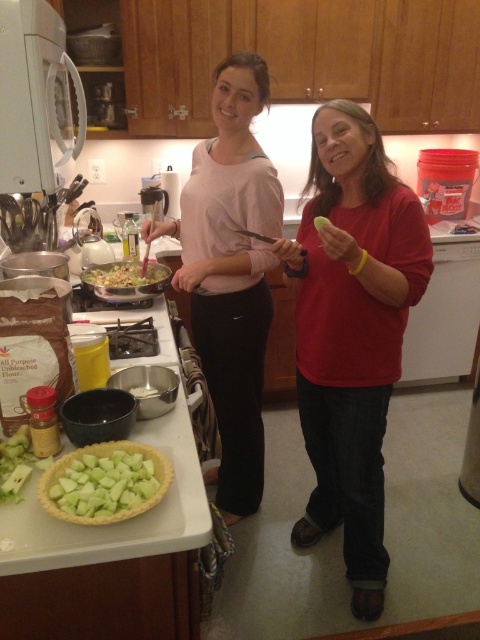
Question: Does matte red shirt at center appear under matte pink shirt at center?

Choices:
 (A) no
 (B) yes

Answer: (B)

Question: Which object is positioned closest to the green matte pie crust at lower left?

Choices:
 (A) matte pink shirt at center
 (B) shiny plastic salad bowl at center
 (C) green matte melon at center
 (D) matte red shirt at center

Answer: (C)

Question: Can you confirm if matte red shirt at center is positioned to the right of green matte melon at center?

Choices:
 (A) no
 (B) yes

Answer: (B)

Question: Does matte red shirt at center have a smaller size compared to green matte melon at center?

Choices:
 (A) yes
 (B) no

Answer: (B)

Question: Considering the real-world distances, which object is closest to the matte red shirt at center?

Choices:
 (A) matte pink shirt at center
 (B) shiny plastic salad bowl at center

Answer: (A)

Question: Among these objects, which one is nearest to the camera?

Choices:
 (A) matte pink shirt at center
 (B) green matte melon at center
 (C) shiny plastic salad bowl at center

Answer: (B)